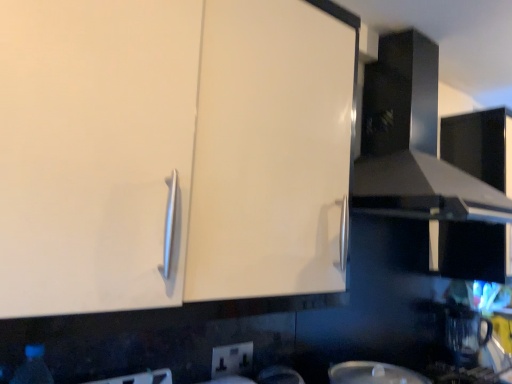
Find the location of a particular element. The image size is (512, 384). vacant space situated above white glossy plate at lower center (from a real-world perspective) is located at coordinates (366, 370).